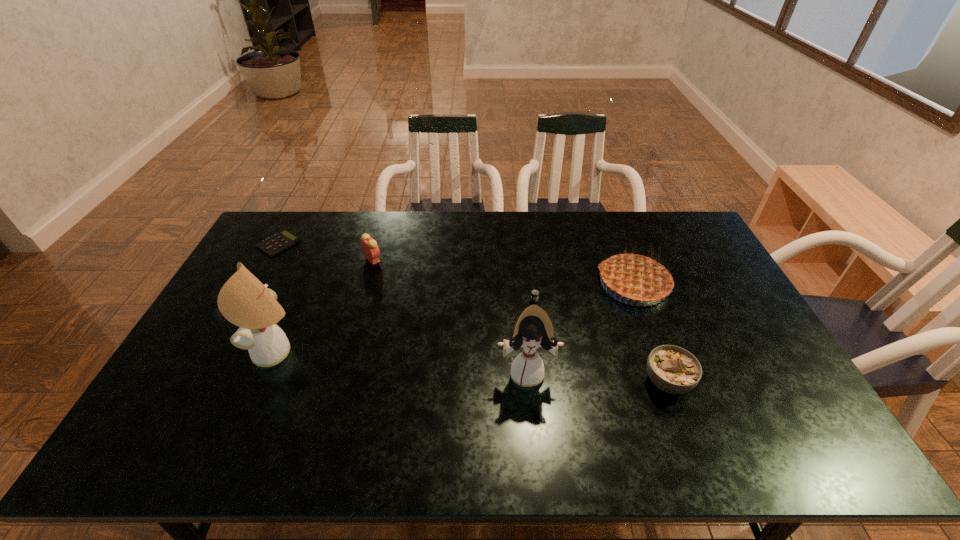
I want to click on free space between the second shortest object and the fifth shortest object, so click(584, 292).

This screenshot has height=540, width=960. In order to click on vacant space in between the second tallest object and the sixth object from right to left in this screenshot , I will do [x=401, y=362].

Find the location of a particular element. This screenshot has height=540, width=960. free spot between the beer can and the alarm clock is located at coordinates (453, 280).

The image size is (960, 540). I want to click on vacant space in between the pie and the sixth tallest object, so point(584,292).

You are a GUI agent. You are given a task and a screenshot of the screen. Output one action in this format:
    pyautogui.click(x=<x>, y=<y>)
    Task: Click on the free space between the left doll and the calculator
    The height and width of the screenshot is (540, 960).
    Given the screenshot: What is the action you would take?
    pyautogui.click(x=277, y=298)

At what (x,y) coordinates should I click in order to perform the action: click on vacant area that lies between the second tallest object and the taller doll. Please return your answer as a coordinate pair (x, y). The height and width of the screenshot is (540, 960). Looking at the image, I should click on pos(401,362).

Locate an element on the screen. free point between the beer can and the second object from left to right is located at coordinates (405, 326).

I want to click on object identified as the fourth closest to the fifth shortest object, so click(370, 248).

What are the coordinates of `object that ranks as the third closest to the second shortest object` in the screenshot? It's located at (674, 370).

This screenshot has height=540, width=960. I want to click on vacant point that satisfies the following two spatial constraints: 1. on the face of the alarm clock; 2. on the right side of the soup bowl, so click(x=338, y=382).